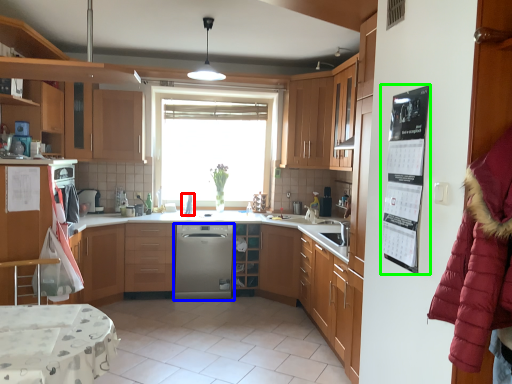
Question: Which is farther away from appliance (highlighted by a red box)? kitchen appliance (highlighted by a blue box) or bulletin board (highlighted by a green box)?

Choices:
 (A) kitchen appliance
 (B) bulletin board

Answer: (B)